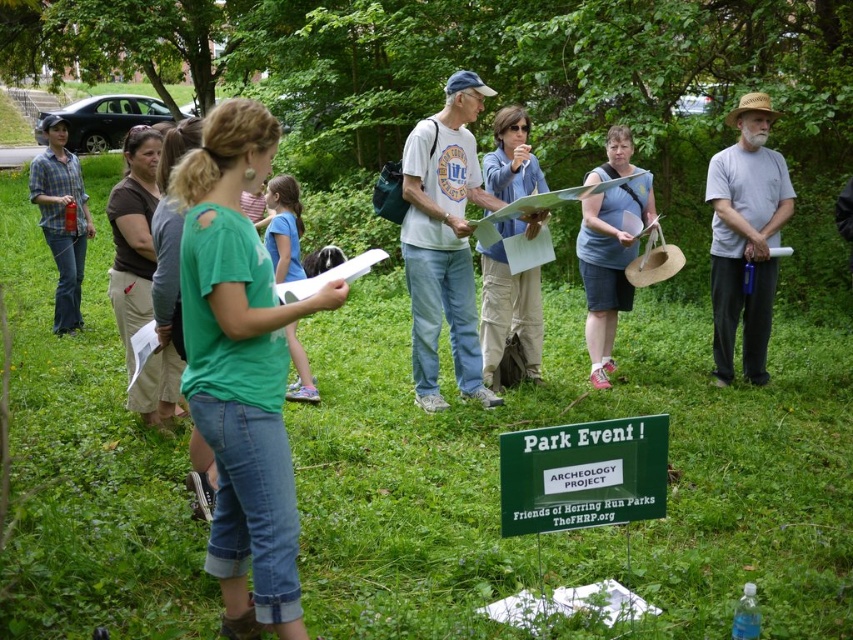
Question: Does green plastic sign at lower center appear under blue cotton shirt at center?

Choices:
 (A) no
 (B) yes

Answer: (B)

Question: Which object appears closest to the camera in this image?

Choices:
 (A) blue cotton shirt at center
 (B) green plastic sign at lower center

Answer: (B)

Question: Which object is the closest to the plaid flannel shirt at left?

Choices:
 (A) green plastic sign at lower center
 (B) gray cotton shirt at center
 (C) blue cotton shirt at center

Answer: (C)

Question: In this image, where is green plastic sign at lower center located relative to matte khaki pants at center?

Choices:
 (A) above
 (B) below

Answer: (B)

Question: Which object appears closest to the camera in this image?

Choices:
 (A) matte khaki pants at center
 (B) blue cotton shirt at center
 (C) plaid flannel shirt at left
 (D) white cotton t-shirt at center

Answer: (D)

Question: Is white cotton t-shirt at center above blue denim shorts at center?

Choices:
 (A) yes
 (B) no

Answer: (A)